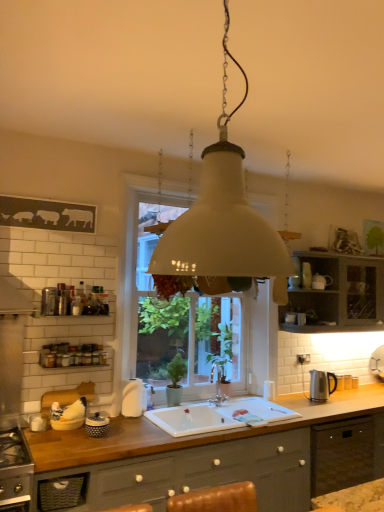
Question: From the image's perspective, is wooden at lower center located above or below white matte soap dispenser at center, the 2th appliance positioned from the right?

Choices:
 (A) below
 (B) above

Answer: (A)

Question: Does point (360, 401) appear closer or farther from the camera than point (135, 406)?

Choices:
 (A) farther
 (B) closer

Answer: (A)

Question: Estimate the real-world distances between objects in this image. Which object is farther from the white ceramic sink at center?

Choices:
 (A) satin nickel kettle at right, arranged as the 3th appliance when viewed from the left
 (B) polka dot ceramic jar at lower left, which ranks as the 3th appliance in back-to-front order
 (C) matte gray cabinet at upper right
 (D) wooden at lower center
 (E) silver metallic faucet at sink center

Answer: (C)

Question: Which object is positioned farthest from the silver metallic faucet at sink center?

Choices:
 (A) white matte pendant light at center
 (B) wooden at lower center
 (C) matte gray cabinet at upper right
 (D) white matte soap dispenser at center, which appears as the 2th appliance when viewed from the back
 (E) white ceramic sink at center

Answer: (C)